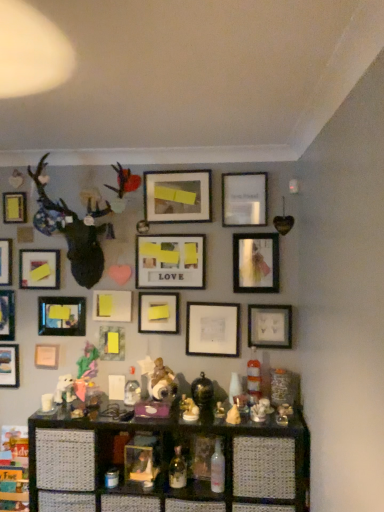
Question: From a real-world perspective, is matte white picture frame at center, marked as the sixth picture frame in a right-to-left arrangement, on white porcelain figurine at center, marked as the second toy in a right-to-left arrangement?

Choices:
 (A) no
 (B) yes

Answer: (B)

Question: Can you confirm if matte white picture frame at center, which is the 10th picture frame in left-to-right order, is thinner than white porcelain figurine at center, marked as the second toy in a right-to-left arrangement?

Choices:
 (A) yes
 (B) no

Answer: (A)

Question: Is matte white picture frame at center, marked as the sixth picture frame in a right-to-left arrangement, oriented away from white porcelain figurine at center, marked as the second toy in a right-to-left arrangement?

Choices:
 (A) no
 (B) yes

Answer: (A)

Question: Is there a large distance between matte white picture frame at center, which is the 10th picture frame in left-to-right order, and white porcelain figurine at center, marked as the 3th toy in a left-to-right arrangement?

Choices:
 (A) no
 (B) yes

Answer: (A)

Question: Considering the relative sizes of matte white picture frame at center, which is the 10th picture frame in left-to-right order, and white porcelain figurine at center, marked as the 3th toy in a left-to-right arrangement, in the image provided, is matte white picture frame at center, which is the 10th picture frame in left-to-right order, wider than white porcelain figurine at center, marked as the 3th toy in a left-to-right arrangement,?

Choices:
 (A) no
 (B) yes

Answer: (A)

Question: In terms of height, does translucent glass bottle at center look taller or shorter compared to matte white picture frame at center, which is the 10th picture frame in left-to-right order?

Choices:
 (A) short
 (B) tall

Answer: (A)

Question: From a real-world perspective, is translucent glass bottle at center physically located above or below matte white picture frame at center, which is the 10th picture frame in left-to-right order?

Choices:
 (A) above
 (B) below

Answer: (B)

Question: Looking at the image, does translucent glass bottle at center seem bigger or smaller compared to matte white picture frame at center, marked as the sixth picture frame in a right-to-left arrangement?

Choices:
 (A) big
 (B) small

Answer: (B)

Question: From the image's perspective, is translucent glass bottle at center located above or below matte white picture frame at center, marked as the sixth picture frame in a right-to-left arrangement?

Choices:
 (A) below
 (B) above

Answer: (A)

Question: From a real-world perspective, is translucent glass bottle at center above or below matte white frame at center, the fourth picture frame viewed from the right?

Choices:
 (A) above
 (B) below

Answer: (B)

Question: In terms of size, does translucent glass bottle at center appear bigger or smaller than matte white frame at center, the twelfth picture frame viewed from the left?

Choices:
 (A) small
 (B) big

Answer: (A)

Question: Based on their positions, is translucent glass bottle at center located to the left or right of matte white frame at center, the twelfth picture frame viewed from the left?

Choices:
 (A) right
 (B) left

Answer: (B)

Question: In the image, is translucent glass bottle at center positioned in front of or behind matte white frame at center, the fourth picture frame viewed from the right?

Choices:
 (A) behind
 (B) front

Answer: (B)

Question: Based on their sizes in the image, would you say matte white picture frame at lower right, the first picture frame positioned from the right, is bigger or smaller than matte wooden picture frame at center, arranged as the 5th picture frame when viewed from the right?

Choices:
 (A) small
 (B) big

Answer: (A)

Question: Looking at their shapes, would you say matte white picture frame at lower right, placed as the 15th picture frame when sorted from left to right, is wider or thinner than matte wooden picture frame at center, the eleventh picture frame from the left?

Choices:
 (A) wide
 (B) thin

Answer: (A)